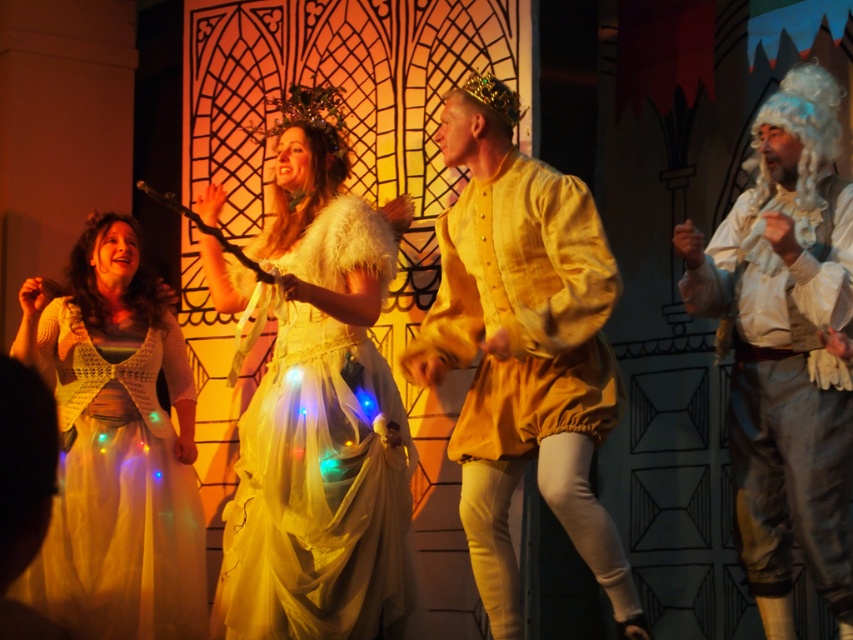
You are an event planner arranging a photo shoot in the described scene. You need to decide if the matte yellow fabric shirt at center can be placed on a mannequin that requires a garment shorter than the white satin wig at right. Can it fit?

The matte yellow fabric shirt at center is shorter than the white satin wig at right, so it can fit on the mannequin that requires a garment shorter than the white satin wig at right.

You are a stagehand who needs to adjust the lighting for the ivory satin dress at center and the white satin wig at right. Based on their positions, which object should you focus the spotlight on first to ensure both are illuminated properly?

The ivory satin dress at center is below the white satin wig at right, so you should focus the spotlight on the white satin wig at right first to avoid casting a shadow over the dress below.